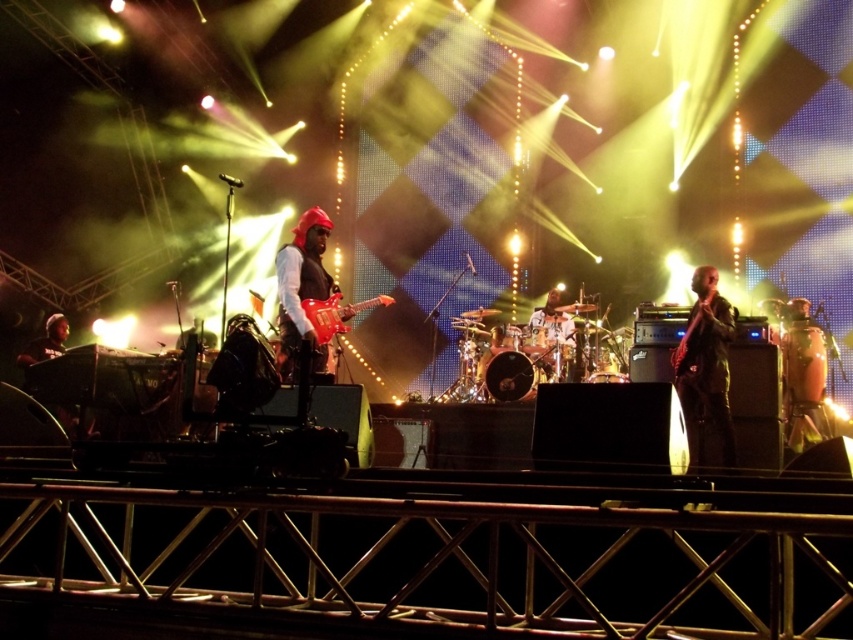
You are a photographer trying to capture the drummer on the right and the guitarist at center. Which object, the black leather jacket at right or the glossy electric guitar at center, is closer to the drummer on the right?

The black leather jacket at right is closer to the drummer on the right because it is positioned on the right side of the glossy electric guitar at center, placing it nearer to the drummer.

You are a photographer standing at the camera position. You want to capture a closeup shot of the black leather jacket at right. Given that your camera has a maximum zoom range of 15 feet, can you get a clear closeup without moving closer?

The black leather jacket at right and camera are 19.05 feet apart. Since the camera can only zoom up to 15 feet, you cannot get a clear closeup without moving closer.